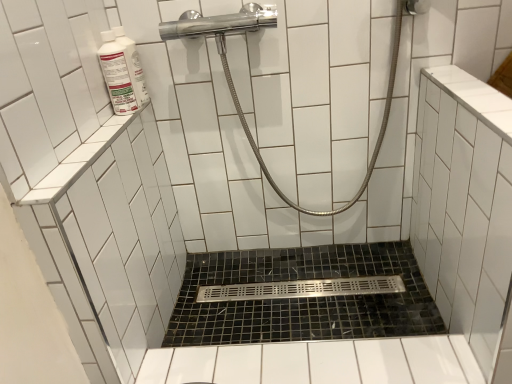
This screenshot has height=384, width=512. What do you see at coordinates (302, 298) in the screenshot?
I see `black mosaic tile bath at center` at bounding box center [302, 298].

What do you see at coordinates (234, 86) in the screenshot? I see `polished chrome showerhead at upper center` at bounding box center [234, 86].

Locate an element on the screen. Image resolution: width=512 pixels, height=384 pixels. black mosaic tile bath at center is located at coordinates (302, 298).

Is point (106, 75) positioned after point (228, 16)?

No.

Does white glossy bottle at upper left, the first cleaning product from the front, have a greater height compared to polished chrome showerhead at upper center?

No, white glossy bottle at upper left, the first cleaning product from the front, is not taller than polished chrome showerhead at upper center.

Considering the relative sizes of white glossy bottle at upper left, arranged as the second cleaning product when viewed from the back, and polished chrome showerhead at upper center in the image provided, is white glossy bottle at upper left, arranged as the second cleaning product when viewed from the back, bigger than polished chrome showerhead at upper center?

Incorrect, white glossy bottle at upper left, arranged as the second cleaning product when viewed from the back, is not larger than polished chrome showerhead at upper center.

Between white glossy bottle at upper left, arranged as the second cleaning product when viewed from the back, and polished chrome showerhead at upper center, which one has larger width?

polished chrome showerhead at upper center is wider.

Identify the location of the 1st cleaning product to the left of the polished chrome showerhead at upper center, starting your count from the anchor. Image resolution: width=512 pixels, height=384 pixels. (133, 66).

Is polished chrome showerhead at upper center not inside white glossy bottle at upper left, which is the 2th cleaning product from front to back?

polished chrome showerhead at upper center lies outside white glossy bottle at upper left, which is the 2th cleaning product from front to back,'s area.

Looking at their sizes, would you say polished chrome showerhead at upper center is wider or thinner than white glossy bottle at upper left, which is the 2th cleaning product from front to back?

polished chrome showerhead at upper center is wider than white glossy bottle at upper left, which is the 2th cleaning product from front to back.

From a real-world perspective, is white glossy bottle at upper left, arranged as the second cleaning product when viewed from the back, on black mosaic tile bath at center?

Correct, in the physical world, white glossy bottle at upper left, arranged as the second cleaning product when viewed from the back, is higher than black mosaic tile bath at center.

Consider the image. From the image's perspective, which is below, white glossy bottle at upper left, arranged as the second cleaning product when viewed from the back, or black mosaic tile bath at center?

black mosaic tile bath at center appears lower in the image.

Which is behind, point (131, 113) or point (278, 256)?

The point (278, 256) is farther from the camera.

You are a GUI agent. You are given a task and a screenshot of the screen. Output one action in this format:
    pyautogui.click(x=<x>, y=<y>)
    Task: Click on the bath that is below the white glossy bottle at upper left, which is the 2th cleaning product from front to back (from the image's perspective)
    The height and width of the screenshot is (384, 512).
    Given the screenshot: What is the action you would take?
    pyautogui.click(x=302, y=298)

From a real-world perspective, relative to black mosaic tile bath at center, is white glossy bottle at upper left, the 1th cleaning product positioned from the back, vertically above or below?

white glossy bottle at upper left, the 1th cleaning product positioned from the back, is above black mosaic tile bath at center.

Considering the relative positions of white glossy bottle at upper left, the 1th cleaning product positioned from the back, and black mosaic tile bath at center in the image provided, is white glossy bottle at upper left, the 1th cleaning product positioned from the back, in front of black mosaic tile bath at center?

Yes, it is.

Is white glossy bottle at upper left, the 1th cleaning product positioned from the back, far away from black mosaic tile bath at center?

white glossy bottle at upper left, the 1th cleaning product positioned from the back, is actually quite close to black mosaic tile bath at center.

Choose the correct answer: Is black mosaic tile bath at center inside white glossy bottle at upper left, arranged as the second cleaning product when viewed from the back, or outside it?

black mosaic tile bath at center is spatially situated outside white glossy bottle at upper left, arranged as the second cleaning product when viewed from the back.

Considering the points (423, 293) and (127, 92), which point is behind, point (423, 293) or point (127, 92)?

The point (423, 293) is behind.

Considering their positions, is black mosaic tile bath at center located in front of or behind white glossy bottle at upper left, the first cleaning product from the front?

In the image, black mosaic tile bath at center appears behind white glossy bottle at upper left, the first cleaning product from the front.

Considering the relative sizes of black mosaic tile bath at center and white glossy bottle at upper left, arranged as the second cleaning product when viewed from the back, in the image provided, is black mosaic tile bath at center bigger than white glossy bottle at upper left, arranged as the second cleaning product when viewed from the back,?

Yes.

Is point (276, 331) farther from camera compared to point (207, 31)?

Yes.

Does black mosaic tile bath at center appear on the right side of polished chrome showerhead at upper center?

Yes.

Based on their sizes in the image, would you say black mosaic tile bath at center is bigger or smaller than polished chrome showerhead at upper center?

Clearly, black mosaic tile bath at center is smaller in size than polished chrome showerhead at upper center.

From a real-world perspective, which object stands above the other?

In real-world perspective, polished chrome showerhead at upper center is above.

From the image's perspective, which one is positioned higher, white glossy bottle at upper left, which is the 2th cleaning product from front to back, or polished chrome showerhead at upper center?

white glossy bottle at upper left, which is the 2th cleaning product from front to back, is shown above in the image.

Which is further, (139, 101) or (203, 25)?

Point (139, 101)

Is white glossy bottle at upper left, which is the 2th cleaning product from front to back, taller or shorter than polished chrome showerhead at upper center?

white glossy bottle at upper left, which is the 2th cleaning product from front to back, is shorter than polished chrome showerhead at upper center.

Choose the correct answer: Is white glossy bottle at upper left, the 1th cleaning product positioned from the back, inside polished chrome showerhead at upper center or outside it?

white glossy bottle at upper left, the 1th cleaning product positioned from the back, is located beyond the bounds of polished chrome showerhead at upper center.

Identify the location of cleaning product that is the 1st one above the polished chrome showerhead at upper center (from a real-world perspective). Image resolution: width=512 pixels, height=384 pixels. (117, 75).

At what (x,y) coordinates should I click in order to perform the action: click on the 2nd cleaning product behind the polished chrome showerhead at upper center, starting your count from the anchor. Please return your answer as a coordinate pair (x, y). This screenshot has width=512, height=384. Looking at the image, I should click on (133, 66).

Which object lies nearer to the anchor point black mosaic tile bath at center, white glossy bottle at upper left, the first cleaning product from the front, or white glossy bottle at upper left, which is the 2th cleaning product from front to back?

The object closer to black mosaic tile bath at center is white glossy bottle at upper left, which is the 2th cleaning product from front to back.

Which object lies nearer to the anchor point white glossy bottle at upper left, arranged as the second cleaning product when viewed from the back, polished chrome showerhead at upper center or white glossy bottle at upper left, the 1th cleaning product positioned from the back?

white glossy bottle at upper left, the 1th cleaning product positioned from the back.

Based on the photo, from the image, which object appears to be nearer to white glossy bottle at upper left, the 1th cleaning product positioned from the back, polished chrome showerhead at upper center or white glossy bottle at upper left, arranged as the second cleaning product when viewed from the back?

white glossy bottle at upper left, arranged as the second cleaning product when viewed from the back, lies closer to white glossy bottle at upper left, the 1th cleaning product positioned from the back, than the other object.

Considering their positions, is black mosaic tile bath at center positioned closer to polished chrome showerhead at upper center than white glossy bottle at upper left, the first cleaning product from the front?

white glossy bottle at upper left, the first cleaning product from the front, lies closer to polished chrome showerhead at upper center than the other object.

When comparing their distances from white glossy bottle at upper left, arranged as the second cleaning product when viewed from the back, does white glossy bottle at upper left, the 1th cleaning product positioned from the back, or polished chrome showerhead at upper center seem closer?

white glossy bottle at upper left, the 1th cleaning product positioned from the back.

Considering their positions, is white glossy bottle at upper left, which is the 2th cleaning product from front to back, positioned further to polished chrome showerhead at upper center than white glossy bottle at upper left, arranged as the second cleaning product when viewed from the back?

The object further to polished chrome showerhead at upper center is white glossy bottle at upper left, arranged as the second cleaning product when viewed from the back.

Estimate the real-world distances between objects in this image. Which object is further from black mosaic tile bath at center, white glossy bottle at upper left, the 1th cleaning product positioned from the back, or polished chrome showerhead at upper center?

The object further to black mosaic tile bath at center is white glossy bottle at upper left, the 1th cleaning product positioned from the back.

When comparing their distances from polished chrome showerhead at upper center, does white glossy bottle at upper left, arranged as the second cleaning product when viewed from the back, or white glossy bottle at upper left, which is the 2th cleaning product from front to back, seem closer?

Based on the image, white glossy bottle at upper left, which is the 2th cleaning product from front to back, appears to be nearer to polished chrome showerhead at upper center.

Where is `shower between white glossy bottle at upper left, the 1th cleaning product positioned from the back, and black mosaic tile bath at center from top to bottom`? shower between white glossy bottle at upper left, the 1th cleaning product positioned from the back, and black mosaic tile bath at center from top to bottom is located at coordinates (234, 86).

What are the coordinates of `shower between white glossy bottle at upper left, arranged as the second cleaning product when viewed from the back, and black mosaic tile bath at center from top to bottom` in the screenshot? It's located at (234, 86).

The width and height of the screenshot is (512, 384). Find the location of `cleaning product located between white glossy bottle at upper left, the first cleaning product from the front, and polished chrome showerhead at upper center in the left-right direction`. cleaning product located between white glossy bottle at upper left, the first cleaning product from the front, and polished chrome showerhead at upper center in the left-right direction is located at coordinates (133, 66).

At what (x,y) coordinates should I click in order to perform the action: click on cleaning product between white glossy bottle at upper left, which is the 2th cleaning product from front to back, and black mosaic tile bath at center from top to bottom. Please return your answer as a coordinate pair (x, y). Looking at the image, I should click on (117, 75).